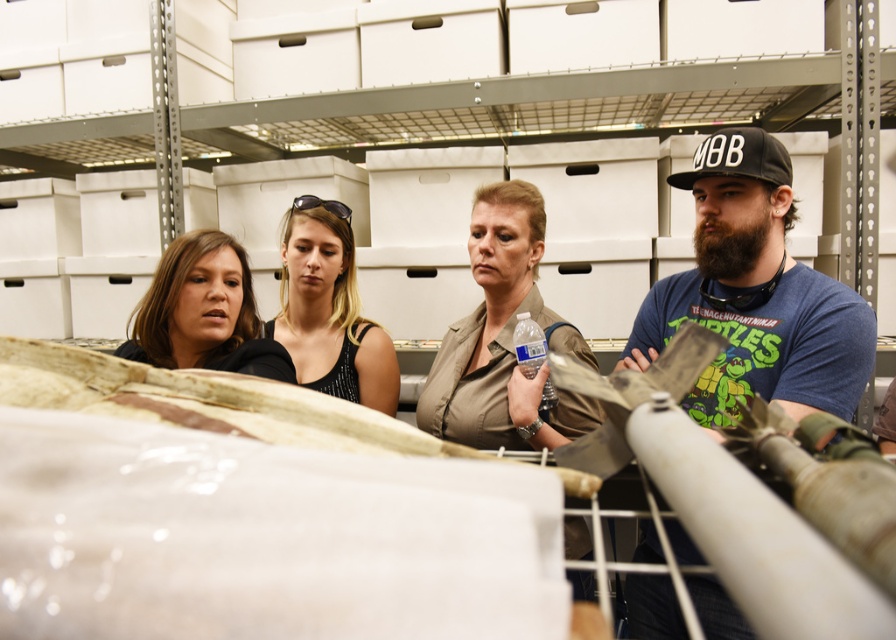
Can you confirm if blue cotton t-shirt at right is wider than clear plastic bottle at center?

Yes.

Does point (657, 307) lie behind point (519, 317)?

Yes.

The image size is (896, 640). I want to click on blue cotton t-shirt at right, so click(755, 292).

Does blue cotton t-shirt at right have a greater height compared to matte black hoodie at left?

Indeed, blue cotton t-shirt at right has a greater height compared to matte black hoodie at left.

This screenshot has width=896, height=640. Identify the location of blue cotton t-shirt at right. (755, 292).

Who is taller, tan fabric shirt at center or black matte baseball cap at right?

tan fabric shirt at center

Is point (478, 272) behind point (719, 173)?

Yes, it is behind point (719, 173).

Locate an element on the screen. tan fabric shirt at center is located at coordinates (498, 337).